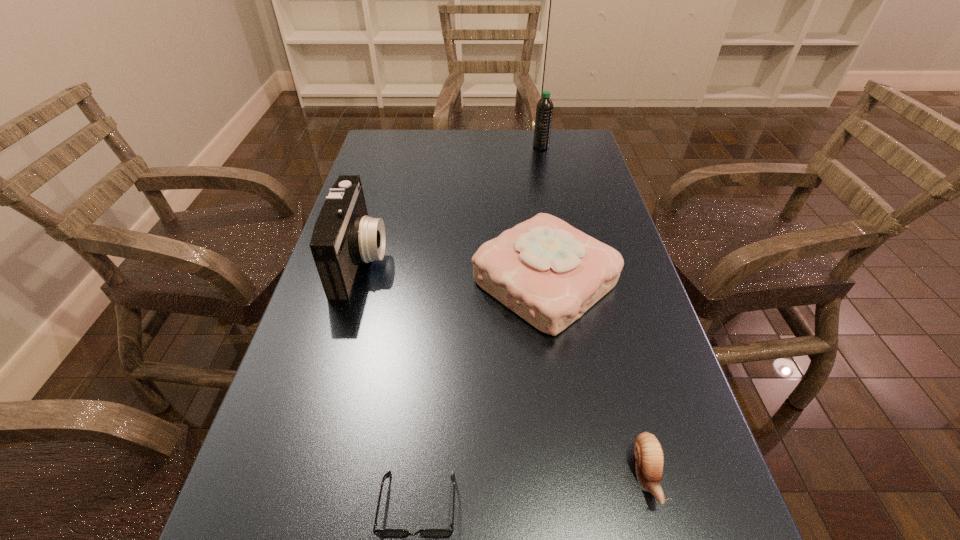
Where is `cake present at the right edge`? cake present at the right edge is located at coordinates (549, 273).

The image size is (960, 540). Identify the location of escargot positioned at the right edge. (649, 459).

You are a GUI agent. You are given a task and a screenshot of the screen. Output one action in this format:
    pyautogui.click(x=<x>, y=<y>)
    Task: Click on the object located in the far right corner section of the desktop
    
    Given the screenshot: What is the action you would take?
    pyautogui.click(x=544, y=110)

The height and width of the screenshot is (540, 960). Identify the location of vacant space at the far edge of the desktop. (492, 156).

Find the location of a particular element. The width and height of the screenshot is (960, 540). free space at the left edge of the desktop is located at coordinates (402, 201).

Where is `free space at the right edge`? free space at the right edge is located at coordinates (598, 210).

Where is `free space at the far left corner of the desktop`? The image size is (960, 540). free space at the far left corner of the desktop is located at coordinates (411, 134).

Find the location of a particular element. Image resolution: width=960 pixels, height=540 pixels. free space between the fourth tallest object and the camcorder is located at coordinates (503, 368).

I want to click on vacant space that's between the farthest object and the fourth tallest object, so click(593, 311).

Locate an element on the screen. This screenshot has height=540, width=960. vacant space that's between the second shortest object and the third tallest object is located at coordinates (595, 379).